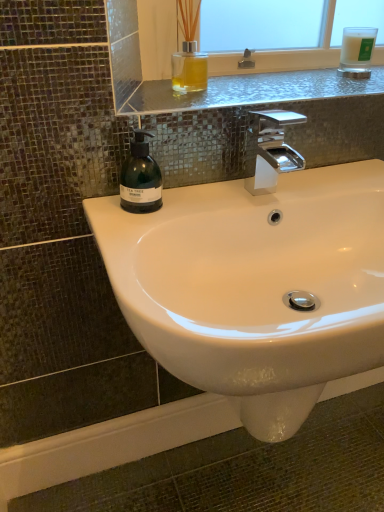
Where is `free space that is to the left of polished chrome faucet at center`? This screenshot has width=384, height=512. free space that is to the left of polished chrome faucet at center is located at coordinates (204, 202).